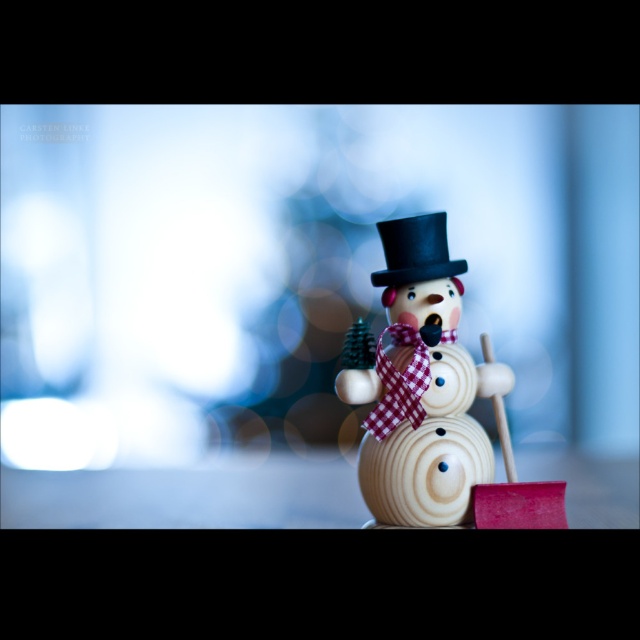
Can you confirm if wooden snowman at center is positioned to the left of black felt top hat at center?

In fact, wooden snowman at center is to the right of black felt top hat at center.

Who is positioned more to the right, wooden snowman at center or black felt top hat at center?

Positioned to the right is wooden snowman at center.

Based on the photo, who is more distant from viewer, (424, 451) or (461, 259)?

Point (461, 259)

Image resolution: width=640 pixels, height=640 pixels. What are the coordinates of `wooden snowman at center` in the screenshot? It's located at (435, 401).